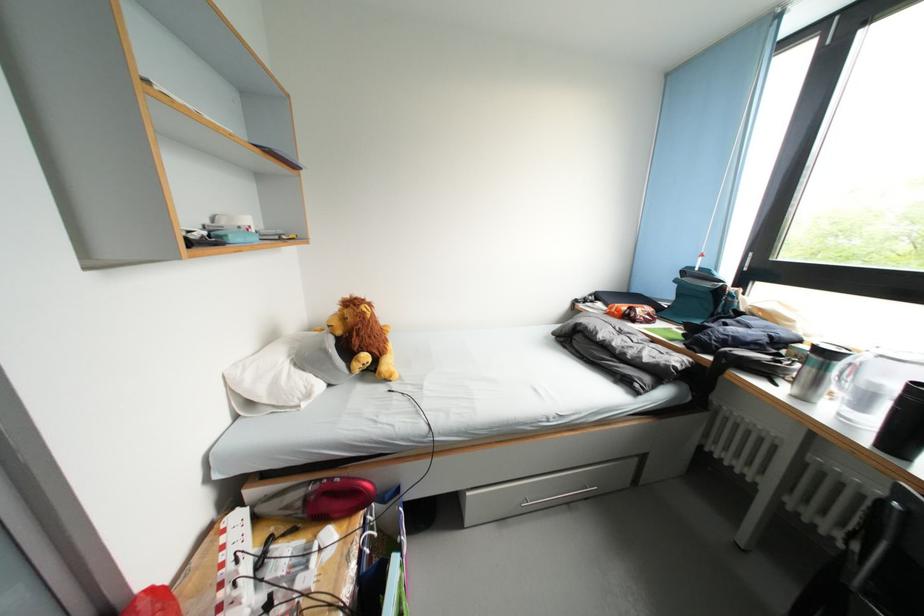
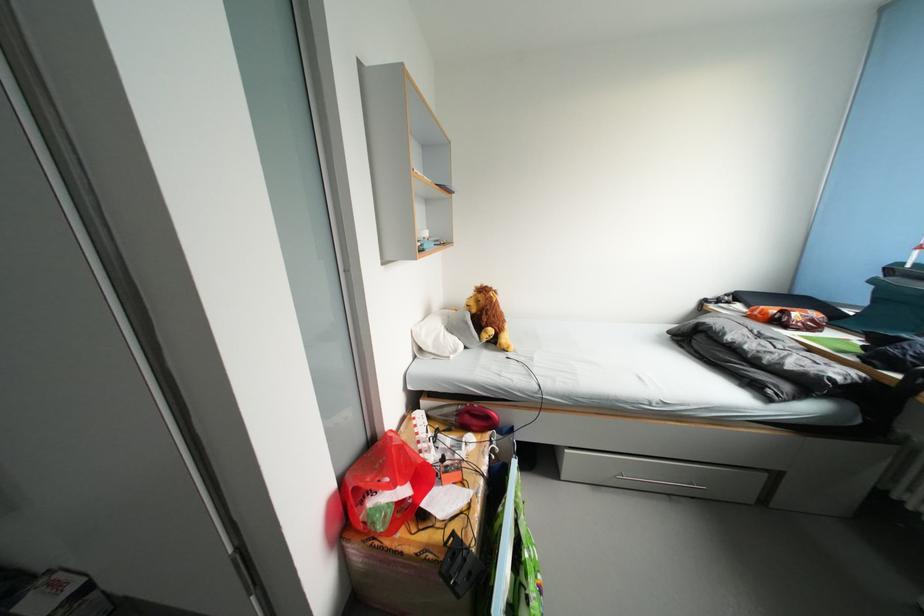
Locate, in the second image, the point that corresponds to point (337, 538) in the first image.

(479, 442)